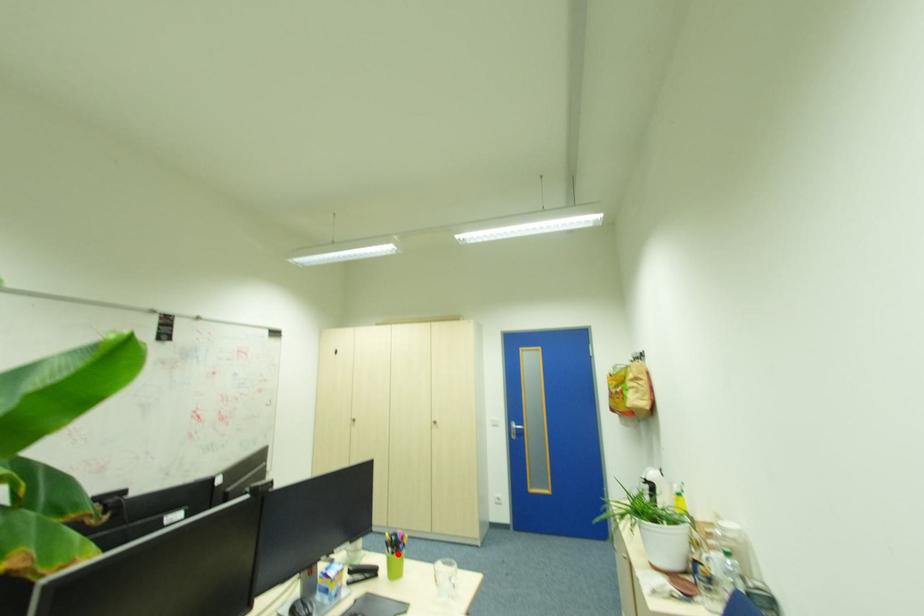
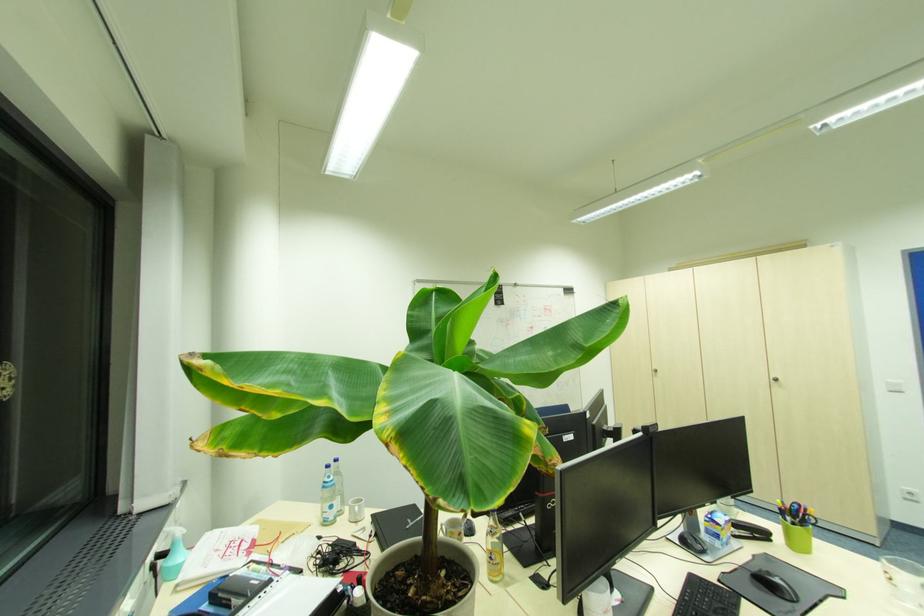
In the second image, find the point that corresponds to the highlighted location in the first image.

(798, 525)